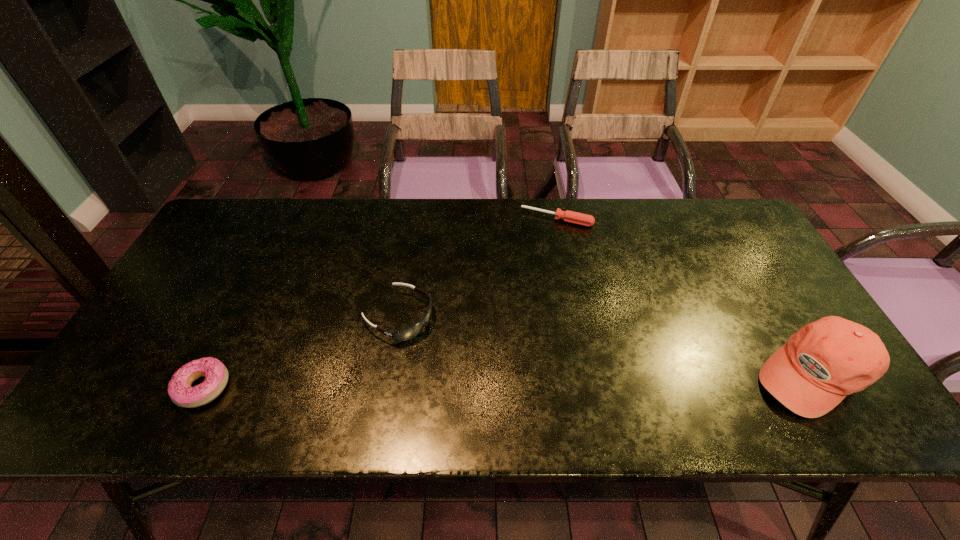
Where is `the leftmost object`? the leftmost object is located at coordinates (180, 391).

Identify the location of the second shortest object. Image resolution: width=960 pixels, height=540 pixels. (180, 391).

I want to click on baseball cap, so click(x=826, y=360).

Identify the location of the tallest object. The image size is (960, 540). (826, 360).

The width and height of the screenshot is (960, 540). I want to click on the shortest object, so click(573, 217).

At what (x,y) coordinates should I click in order to perform the action: click on the second object from right to left. Please return your answer as a coordinate pair (x, y). Image resolution: width=960 pixels, height=540 pixels. Looking at the image, I should click on (573, 217).

Locate an element on the screen. The height and width of the screenshot is (540, 960). the second object from left to right is located at coordinates click(415, 329).

This screenshot has width=960, height=540. In order to click on free space located 0.360m on the right of the leftmost object in this screenshot , I will do `click(388, 387)`.

Where is `vacant space located 0.220m at the tip of the second object from right to left`? The height and width of the screenshot is (540, 960). vacant space located 0.220m at the tip of the second object from right to left is located at coordinates (526, 274).

Where is `vacant space located 0.180m at the tip of the second object from right to left`? The width and height of the screenshot is (960, 540). vacant space located 0.180m at the tip of the second object from right to left is located at coordinates (530, 265).